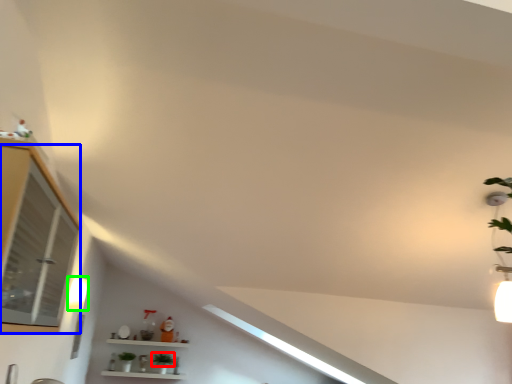
Question: Which object is positioned farthest from plant (highlighted by a red box)? Select from window (highlighted by a blue box) and light fixture (highlighted by a green box).

Choices:
 (A) window
 (B) light fixture

Answer: (A)